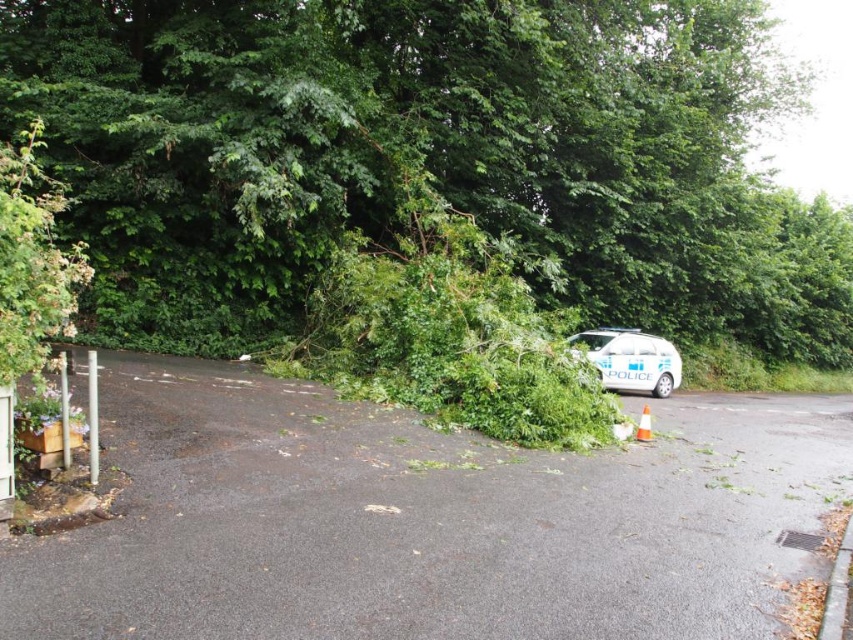
Which is above, green leafy tree at center or white metallic police car at center?

Positioned higher is green leafy tree at center.

I want to click on green leafy tree at center, so click(428, 154).

The image size is (853, 640). Describe the element at coordinates (428, 154) in the screenshot. I see `green leafy tree at center` at that location.

This screenshot has height=640, width=853. In order to click on green leafy tree at center in this screenshot , I will do `click(428, 154)`.